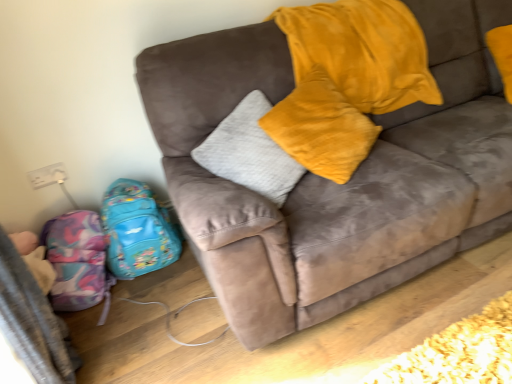
Question: From a real-world perspective, is suede couch at center physically above shiny blue backpack at lower left, which ranks as the 1th luggage in right-to-left order?

Choices:
 (A) no
 (B) yes

Answer: (B)

Question: Can you confirm if suede couch at center is shorter than shiny blue backpack at lower left, which is counted as the 2th luggage, starting from the left?

Choices:
 (A) no
 (B) yes

Answer: (A)

Question: Can you confirm if suede couch at center is positioned to the left of shiny blue backpack at lower left, which ranks as the 1th luggage in right-to-left order?

Choices:
 (A) no
 (B) yes

Answer: (A)

Question: Could you tell me if suede couch at center is facing shiny blue backpack at lower left, which is counted as the 2th luggage, starting from the left?

Choices:
 (A) yes
 (B) no

Answer: (B)

Question: Considering the relative sizes of suede couch at center and shiny blue backpack at lower left, which is counted as the 2th luggage, starting from the left, in the image provided, is suede couch at center taller than shiny blue backpack at lower left, which is counted as the 2th luggage, starting from the left,?

Choices:
 (A) no
 (B) yes

Answer: (B)

Question: From the image's perspective, relative to shiny blue backpack at lower left, which ranks as the 1th luggage in right-to-left order, is velvet yellow pillow at upper center above or below?

Choices:
 (A) above
 (B) below

Answer: (A)

Question: Is point (311, 135) closer or farther from the camera than point (144, 235)?

Choices:
 (A) closer
 (B) farther

Answer: (A)

Question: Considering the positions of velvet yellow pillow at upper center and shiny blue backpack at lower left, which is counted as the 2th luggage, starting from the left, in the image, is velvet yellow pillow at upper center wider or thinner than shiny blue backpack at lower left, which is counted as the 2th luggage, starting from the left,?

Choices:
 (A) wide
 (B) thin

Answer: (B)

Question: Is velvet yellow pillow at upper center bigger or smaller than shiny blue backpack at lower left, which ranks as the 1th luggage in right-to-left order?

Choices:
 (A) big
 (B) small

Answer: (A)

Question: Visually, is suede couch at center positioned to the left or to the right of velvet yellow pillow at upper center?

Choices:
 (A) left
 (B) right

Answer: (B)

Question: Is suede couch at center in front of or behind velvet yellow pillow at upper center in the image?

Choices:
 (A) front
 (B) behind

Answer: (A)

Question: Looking at their shapes, would you say suede couch at center is wider or thinner than velvet yellow pillow at upper center?

Choices:
 (A) thin
 (B) wide

Answer: (B)

Question: Is suede couch at center bigger or smaller than velvet yellow pillow at upper center?

Choices:
 (A) big
 (B) small

Answer: (A)

Question: From a real-world perspective, is multicolored fabric backpack at lower left, the second luggage in the right-to-left sequence, above or below shiny blue backpack at lower left, which ranks as the 1th luggage in right-to-left order?

Choices:
 (A) below
 (B) above

Answer: (A)

Question: Considering the positions of multicolored fabric backpack at lower left, placed as the first luggage when sorted from left to right, and shiny blue backpack at lower left, which is counted as the 2th luggage, starting from the left, in the image, is multicolored fabric backpack at lower left, placed as the first luggage when sorted from left to right, taller or shorter than shiny blue backpack at lower left, which is counted as the 2th luggage, starting from the left,?

Choices:
 (A) tall
 (B) short

Answer: (B)